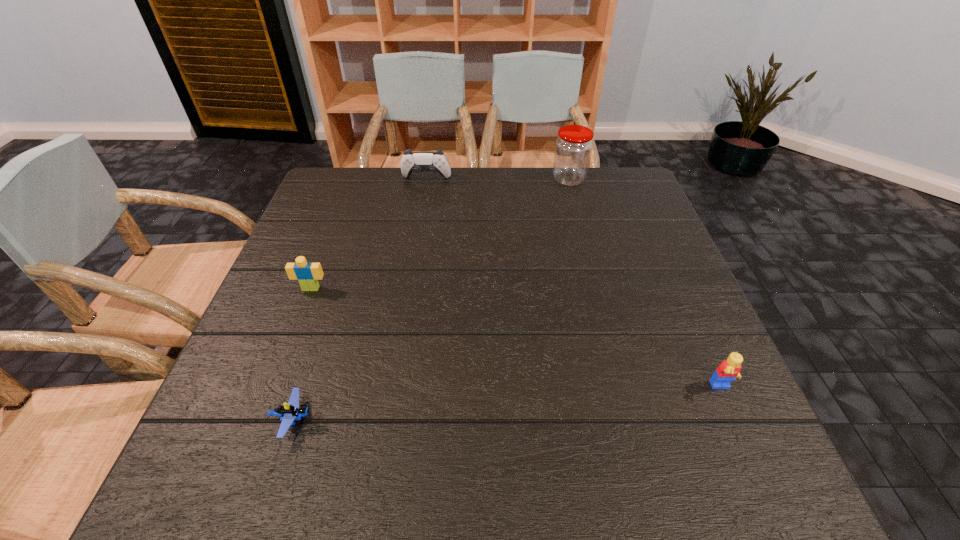
Image resolution: width=960 pixels, height=540 pixels. In order to click on free spot that satisfies the following two spatial constraints: 1. on the front side of the tallest object; 2. on the front-facing side of the shortest object in this screenshot , I will do `click(634, 420)`.